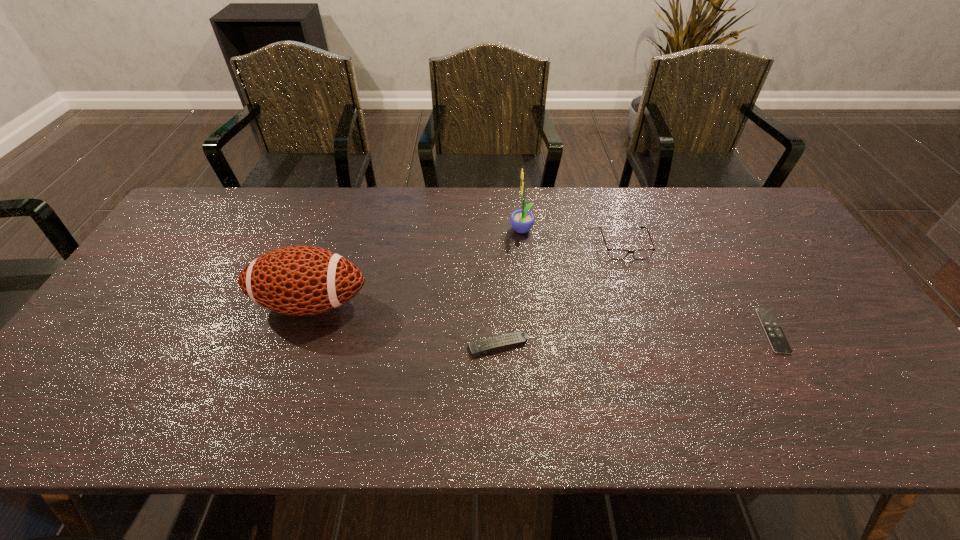
You are a GUI agent. You are given a task and a screenshot of the screen. Output one action in this format:
    pyautogui.click(x=<x>, y=<y>)
    Task: Click on the free space between the third shortest object and the fourth tallest object
    Image resolution: width=960 pixels, height=540 pixels.
    Given the screenshot: What is the action you would take?
    pyautogui.click(x=561, y=295)

I want to click on vacant point located between the spectacles and the sunflower, so click(x=573, y=238).

This screenshot has width=960, height=540. In order to click on free point between the rightmost object and the football in this screenshot , I will do `click(541, 317)`.

Find the location of a particular element. the closest object to the second object from right to left is located at coordinates (522, 221).

Identify the location of the second closest object to the sunflower. (481, 346).

What are the coordinates of `free point that satisfies the following two spatial constraints: 1. on the front-facing side of the tallest object; 2. on the front side of the football` in the screenshot? It's located at (529, 303).

Find the location of `vacant region that satisfies the following two spatial constraints: 1. on the front side of the football; 2. on the right side of the right remote control`. vacant region that satisfies the following two spatial constraints: 1. on the front side of the football; 2. on the right side of the right remote control is located at coordinates pos(301,331).

Where is `blank area in the image that satisfies the following two spatial constraints: 1. on the back side of the taller remote control; 2. on the right side of the right remote control`? This screenshot has height=540, width=960. blank area in the image that satisfies the following two spatial constraints: 1. on the back side of the taller remote control; 2. on the right side of the right remote control is located at coordinates (498, 331).